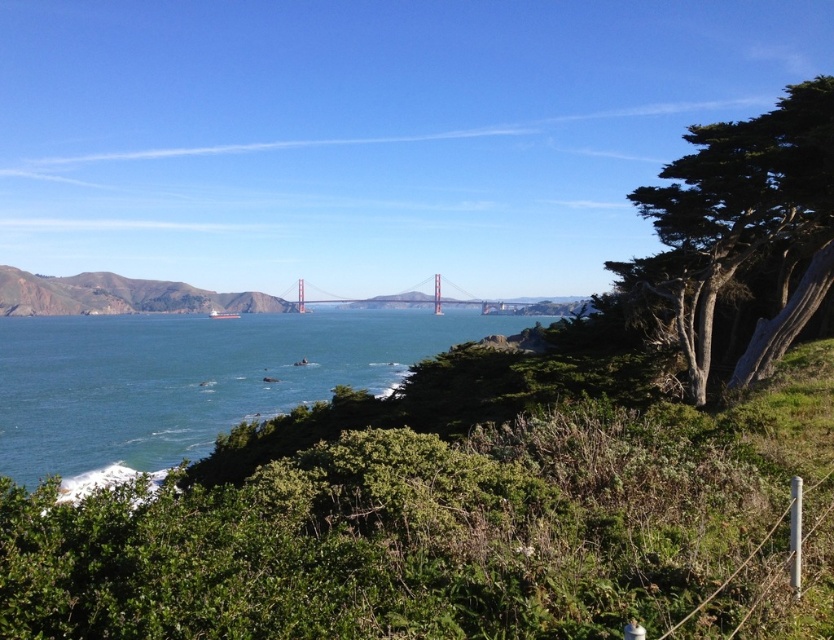
You are a photographer planning to capture the Golden Gate Bridge with both the blue water at center and the brown rocky hill at left in the frame. Which object will occupy more of the photo composition?

The blue water at center will occupy more of the photo composition because it is bigger than the brown rocky hill at left.

You are a photographer planning to capture the Golden Gate Bridge from this vantage point. You notice the blue water at center and the brown rocky hill at left. Which object would you focus on if you want to highlight the contrast between the bridge and the surrounding natural elements?

The blue water at center is wider than the brown rocky hill at left, so focusing on the blue water at center would better highlight the contrast between the bridge and the surrounding natural elements due to its broader presence in the scene.

You are a photographer planning to capture the Golden Gate Bridge from this vantage point. You want to ensure the brown rocky hill at left and the painted steel bridge at center are both visible in your shot. Based on their positions, which object will appear closer to the camera in the final photograph?

The brown rocky hill at left will appear closer to the camera in the final photograph because it is positioned in front of the painted steel bridge at center.